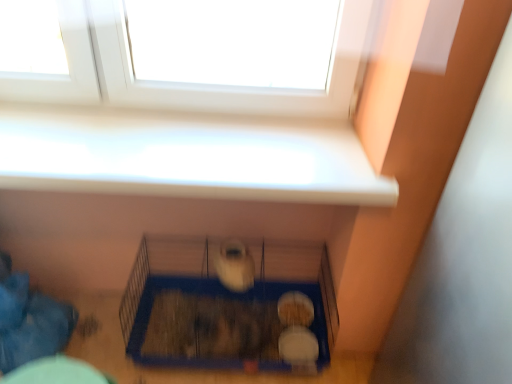
Question: Is white plastic window at upper center not within blue wire bird cage at center?

Choices:
 (A) no
 (B) yes

Answer: (B)

Question: Are white plastic window at upper center and blue wire bird cage at center beside each other?

Choices:
 (A) yes
 (B) no

Answer: (B)

Question: From a real-world perspective, is white plastic window at upper center located beneath blue wire bird cage at center?

Choices:
 (A) yes
 (B) no

Answer: (B)

Question: Does white plastic window at upper center have a smaller size compared to blue wire bird cage at center?

Choices:
 (A) yes
 (B) no

Answer: (A)

Question: Can you confirm if white plastic window at upper center is positioned to the left of blue wire bird cage at center?

Choices:
 (A) yes
 (B) no

Answer: (A)

Question: Can you confirm if white plastic window at upper center is thinner than blue wire bird cage at center?

Choices:
 (A) no
 (B) yes

Answer: (B)

Question: Is blue wire bird cage at center not near white plastic window at upper center?

Choices:
 (A) no
 (B) yes

Answer: (A)

Question: Does blue wire bird cage at center have a smaller size compared to white plastic window at upper center?

Choices:
 (A) no
 (B) yes

Answer: (A)

Question: Is blue wire bird cage at center turned away from white plastic window at upper center?

Choices:
 (A) no
 (B) yes

Answer: (A)

Question: Does blue wire bird cage at center have a lesser width compared to white plastic window at upper center?

Choices:
 (A) yes
 (B) no

Answer: (B)

Question: Is blue wire bird cage at center to the left of white plastic window at upper center from the viewer's perspective?

Choices:
 (A) yes
 (B) no

Answer: (B)

Question: Is blue wire bird cage at center wider than white plastic window at upper center?

Choices:
 (A) yes
 (B) no

Answer: (A)

Question: Considering the positions of white plastic window at upper center and blue wire bird cage at center in the image, is white plastic window at upper center taller or shorter than blue wire bird cage at center?

Choices:
 (A) tall
 (B) short

Answer: (B)